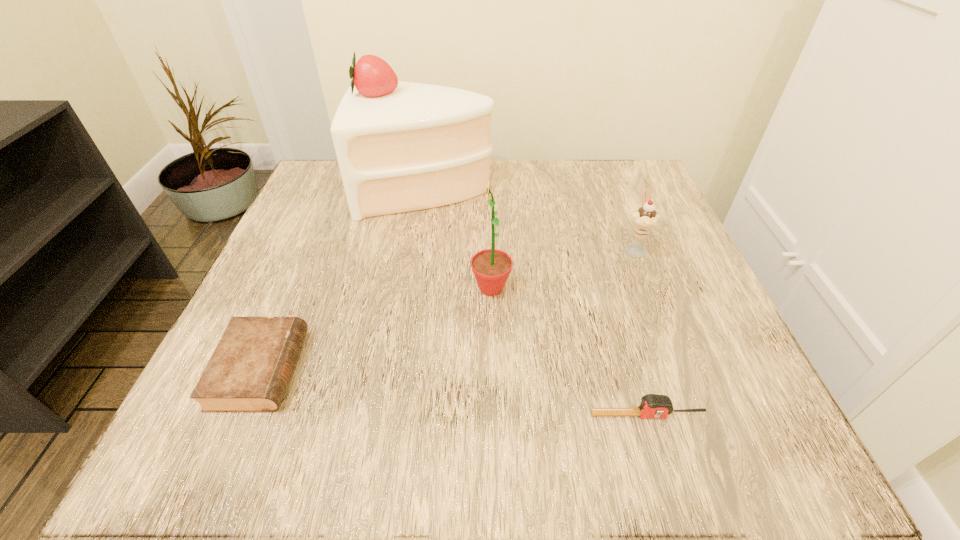
In order to click on the farthest object in this screenshot , I will do `click(401, 146)`.

This screenshot has height=540, width=960. In order to click on cake in this screenshot , I will do `click(401, 146)`.

At what (x,y) coordinates should I click in order to perform the action: click on the third farthest object. Please return your answer as a coordinate pair (x, y). Looking at the image, I should click on (491, 267).

Find the location of a particular element. Image resolution: width=960 pixels, height=540 pixels. the second tallest object is located at coordinates 491,267.

Where is `the third tallest object`? the third tallest object is located at coordinates (644, 219).

Where is `the fourth nearest object`? Image resolution: width=960 pixels, height=540 pixels. the fourth nearest object is located at coordinates (644, 219).

Identify the location of tape measure. The image size is (960, 540). [x=652, y=405].

Where is `diary`? diary is located at coordinates (249, 371).

Image resolution: width=960 pixels, height=540 pixels. What are the coordinates of `free space located on the front of the tallest object` in the screenshot? It's located at (412, 291).

Locate an element on the screen. free space located 0.280m on the face of the sunflower is located at coordinates (313, 288).